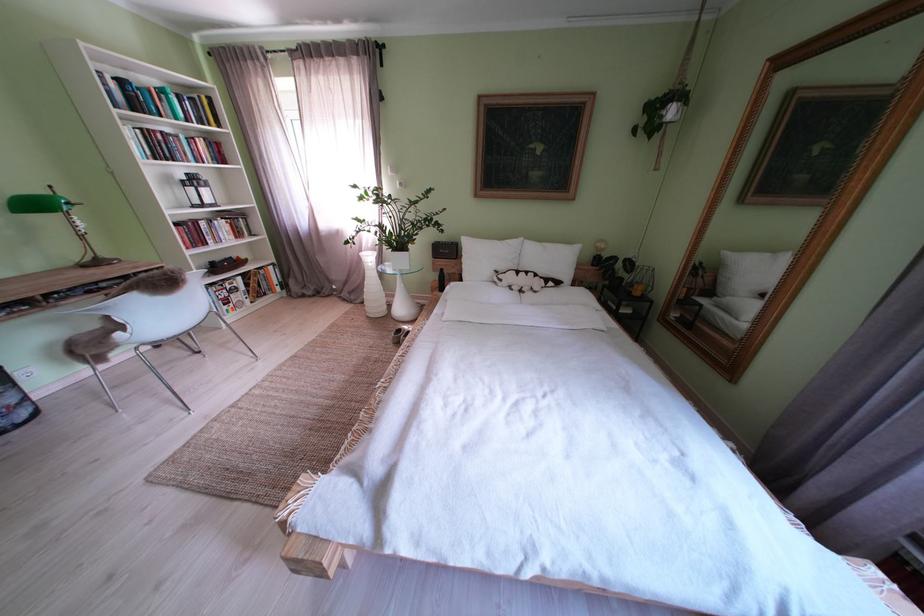
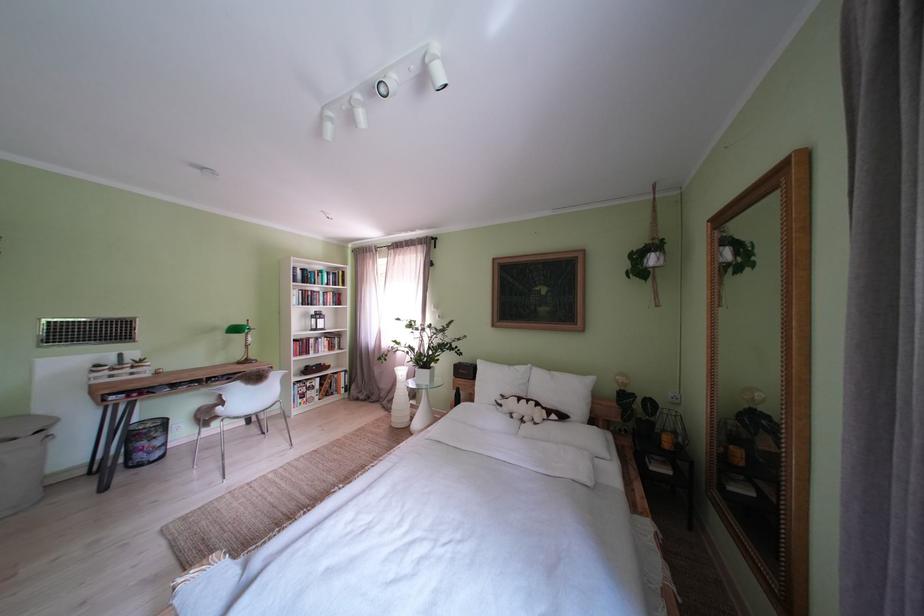
The point at (46,209) is marked in the first image. Where is the corresponding point in the second image?

(247, 334)